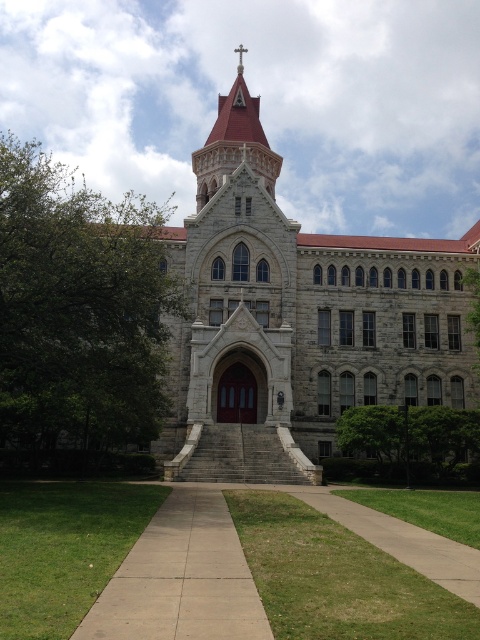
Locate an element on the screen. gray stone church at center is located at coordinates (297, 320).

Between gray stone church at center and reddish-brown stone spire at center, which one is positioned lower?

gray stone church at center

Which is behind, point (276, 404) or point (252, 145)?

Point (252, 145)

This screenshot has height=640, width=480. I want to click on gray stone church at center, so click(x=297, y=320).